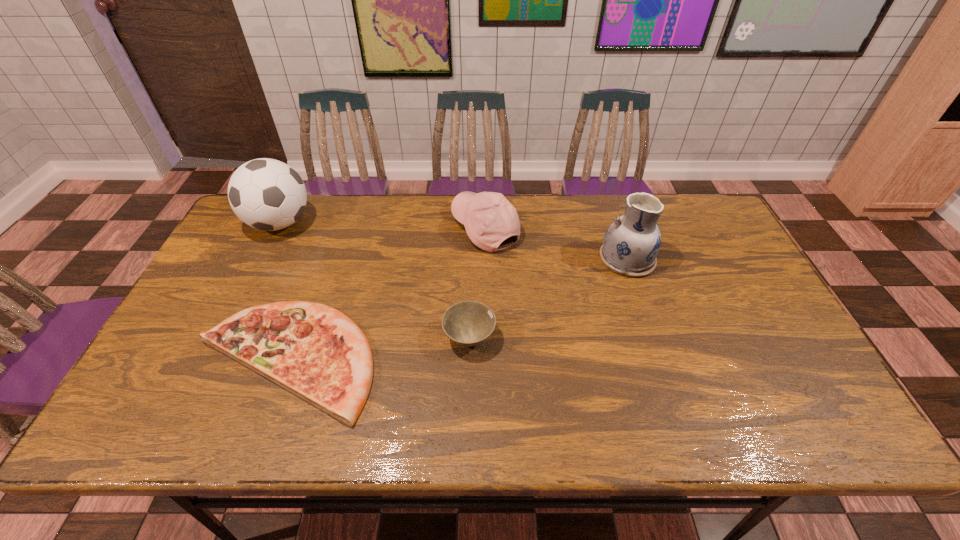
Find the location of `vacant region located 0.350m on the left of the fourth tallest object`. vacant region located 0.350m on the left of the fourth tallest object is located at coordinates (307, 338).

This screenshot has height=540, width=960. In order to click on vacant region located on the back of the pizza in this screenshot , I will do `click(328, 238)`.

Identify the location of soccer ball at the far edge. Image resolution: width=960 pixels, height=540 pixels. (266, 194).

Locate an element on the screen. baseball cap located at the far edge is located at coordinates (489, 218).

Locate an element on the screen. The width and height of the screenshot is (960, 540). object located in the near edge section of the desktop is located at coordinates (316, 352).

Where is `soccer ball that is at the left edge`? The width and height of the screenshot is (960, 540). soccer ball that is at the left edge is located at coordinates (266, 194).

Find the location of a particular element. The image size is (960, 540). pizza at the left edge is located at coordinates (316, 352).

Where is `object that is at the far left corner`? The image size is (960, 540). object that is at the far left corner is located at coordinates (266, 194).

Image resolution: width=960 pixels, height=540 pixels. I want to click on object that is positioned at the near left corner, so (x=316, y=352).

What are the coordinates of `vacant space at the far edge` in the screenshot? It's located at (337, 230).